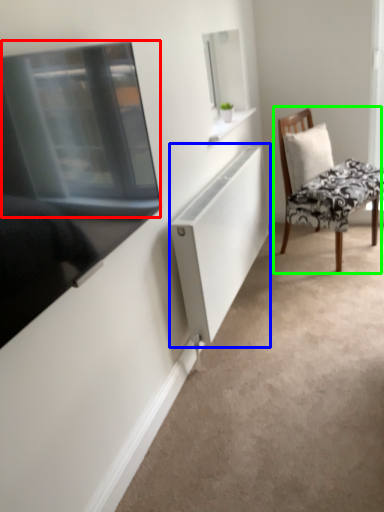
Question: Based on their relative distances, which object is nearer to window screen (highlighted by a red box)? Choose from cabinet (highlighted by a blue box) and chair (highlighted by a green box).

Choices:
 (A) cabinet
 (B) chair

Answer: (A)